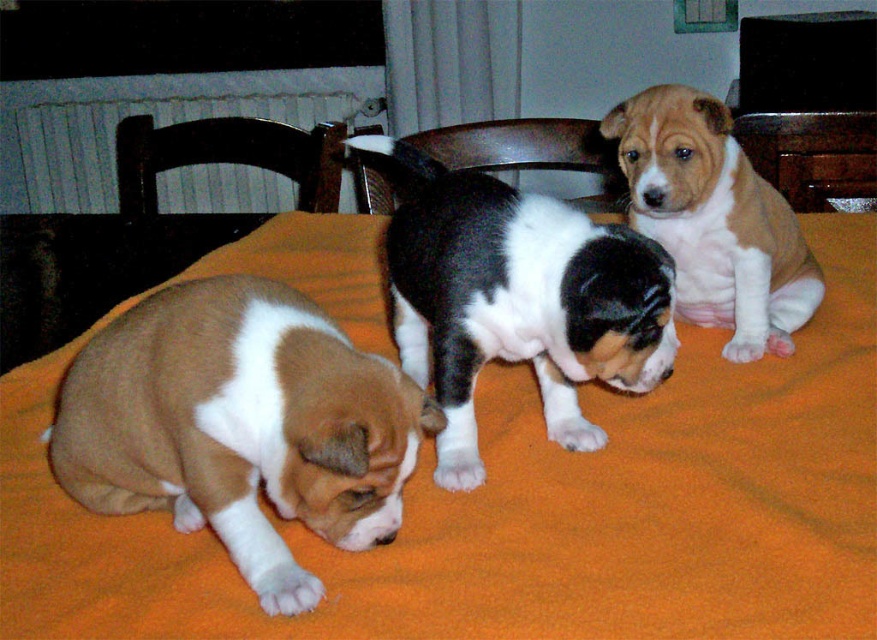
You are a dog owner who wants to place a 4 feet long toy between the brown and white fur at lower left and the dark wood chair at upper left. Will there be enough space for the toy to fit between them?

The brown and white fur at lower left is 3.58 feet away from the dark wood chair at upper left. Since the toy is 4 feet long, it will not fit between them because the distance is shorter than the toy.

Based on the photo, you are a photographer trying to capture a clear photo of the black and white fur at center without the dark wood chair at upper left blocking the view. Based on the scene description, can you position yourself in a way to achieve this?

The black and white fur at center is in front of the dark wood chair at upper left, so if you position yourself behind the black and white fur at center, you can take the photo without the chair blocking the view.